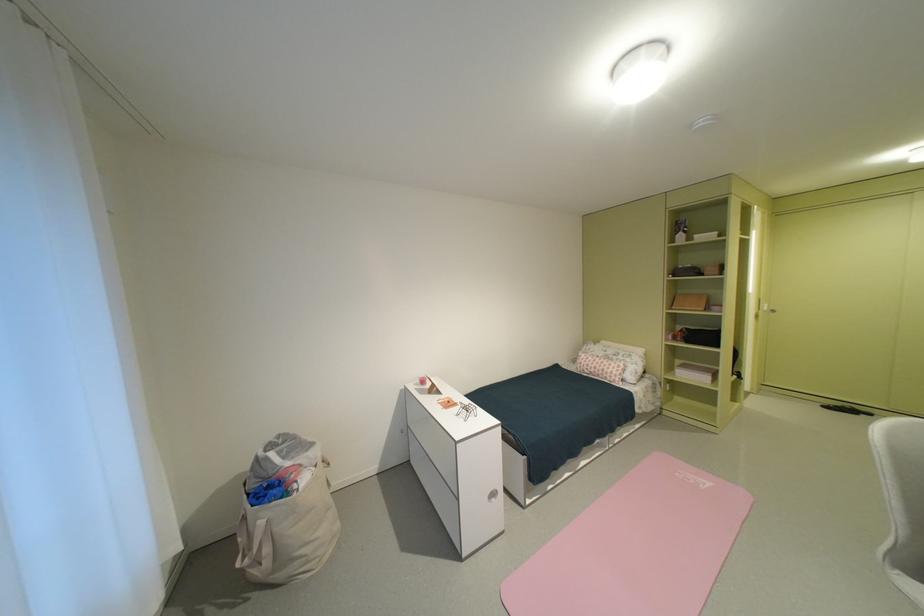
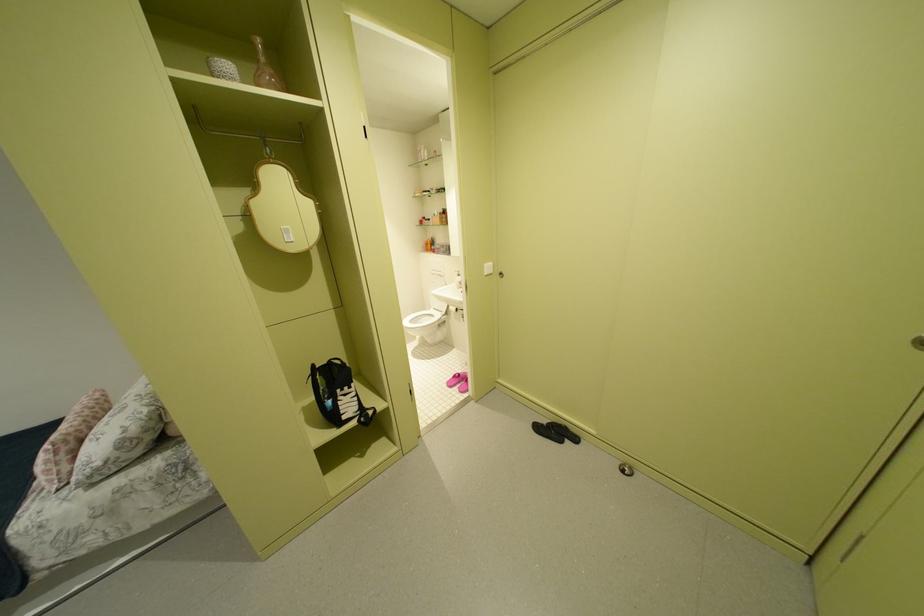
In a continuous first-person perspective shot, in which direction is the camera moving?

The cameraman moved toward right, forward.